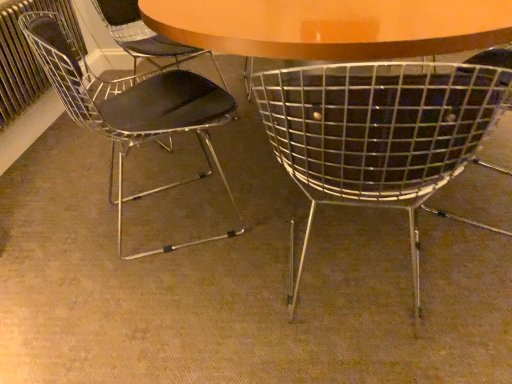
At what (x,y) coordinates should I click in order to perform the action: click on blank area beneath metal mesh chair at center, which is the second chair in left-to-right order (from a real-world perspective). Please return your answer as a coordinate pair (x, y). The width and height of the screenshot is (512, 384). Looking at the image, I should click on (353, 299).